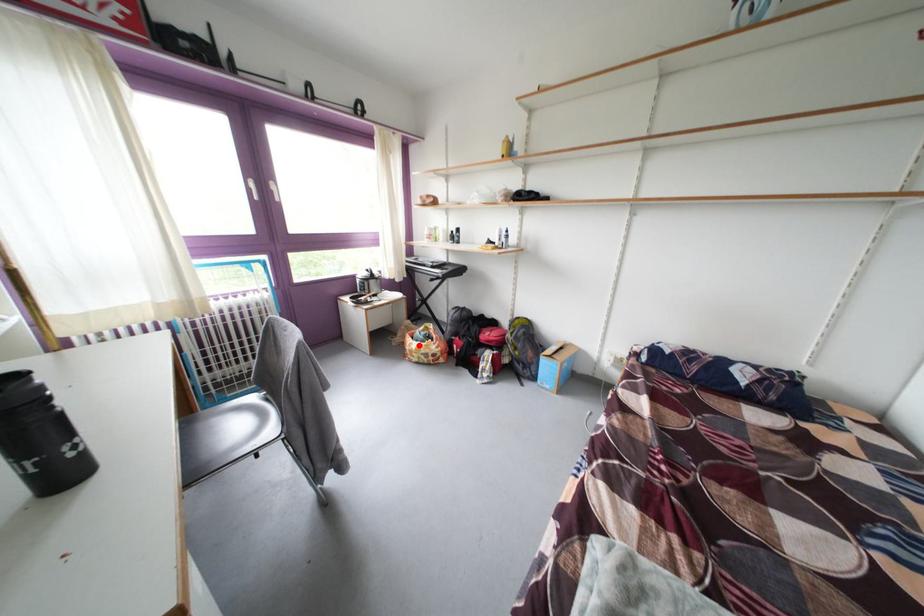
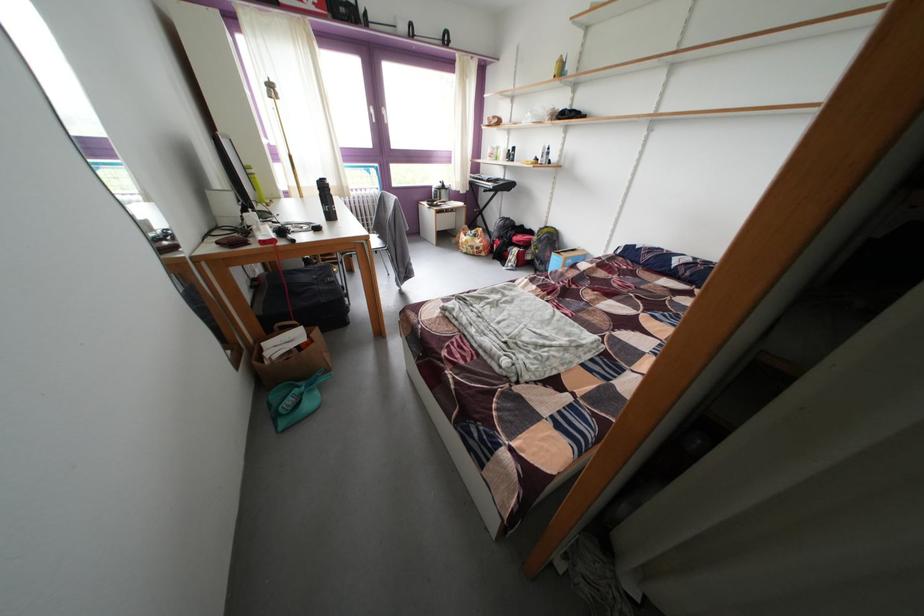
Question: I am providing you with two images of the same scene from different viewpoints. Given a red point in image1, look at the same physical point in image2. Is it:

Choices:
 (A) Closer to the viewpoint
 (B) Farther from the viewpoint

Answer: (A)